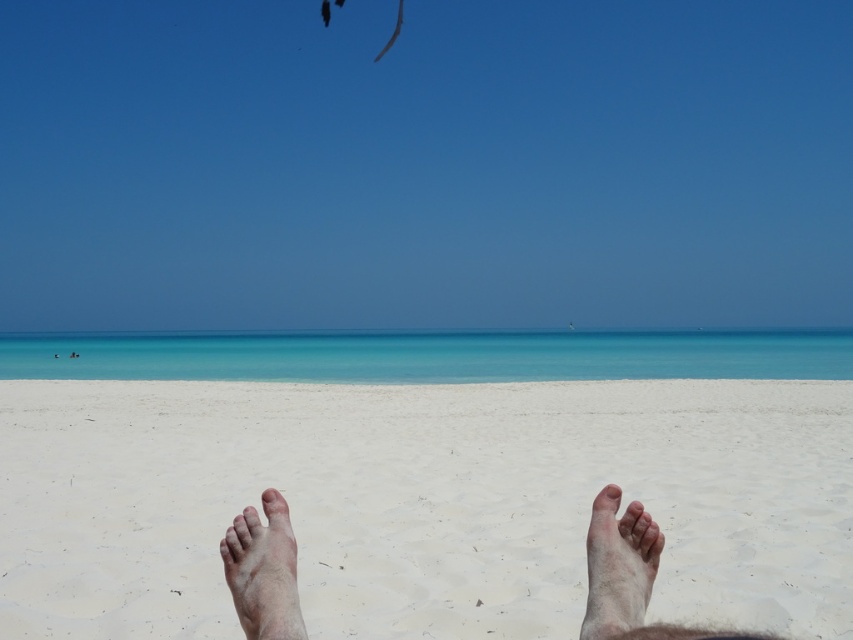
Is pale skin toe at center below pale skin toe at lower center?

Yes.

Between point (260, 496) and point (611, 500), which one is positioned in front?

Positioned in front is point (611, 500).

This screenshot has height=640, width=853. I want to click on pale skin toe at center, so click(270, 497).

Between point (457, 468) and point (244, 589), which one is positioned behind?

The point (457, 468) is more distant.

Does white sandy feet at center appear on the right side of skinny bare feet at center?

Yes, white sandy feet at center is to the right of skinny bare feet at center.

In order to click on white sandy feet at center in this screenshot , I will do `click(421, 502)`.

I want to click on dry skin foot at lower left, so click(263, 573).